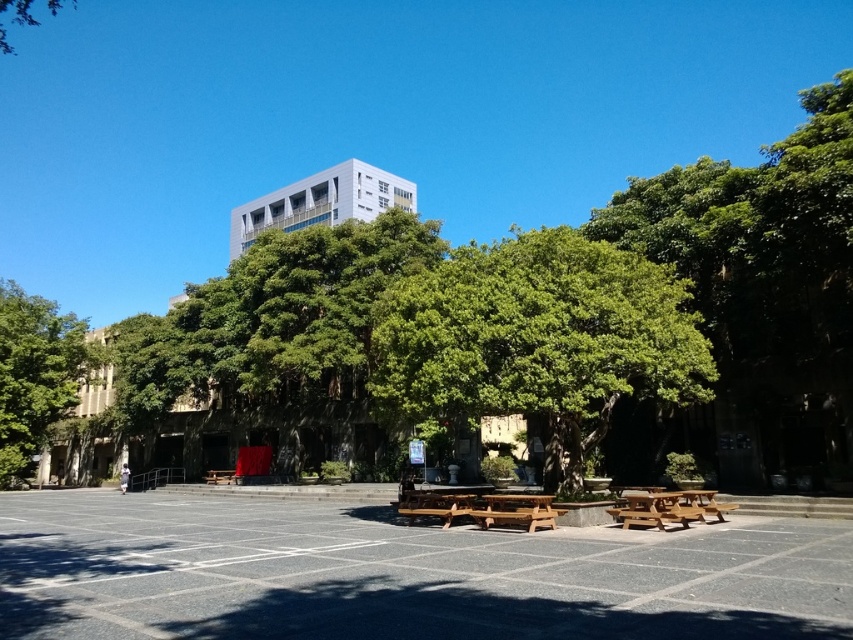
You are planning to set up an outdoor event and need to place a large tent. The tent requires a clear space of 3 meters in width. Considering the wooden picnic table at center and the green leafy tree at upper left, which object is closer to the left edge of the scene, and would that allow enough space for the tent?

The green leafy tree at upper left is closer to the left edge of the scene. Since the wooden picnic table at center is to the right of the green leafy tree at upper left, there might be sufficient space between the tree and the picnic table to accommodate the tent, but the exact distance isn

You are standing at the point labeled as point (35, 372) in the image. Looking around, you see a green leafy tree at left. What object is directly in front of you?

The point (35, 372) corresponds to the green leafy tree at left, so the green leafy tree at left is directly in front of you.

You are standing at the entrance of the plaza and want to find the wooden picnic table at center. According to the coordinates, where should you look relative to the entrance?

The wooden picnic table at center is located at coordinates point (668, 508), which is towards the upper right direction from the entrance.